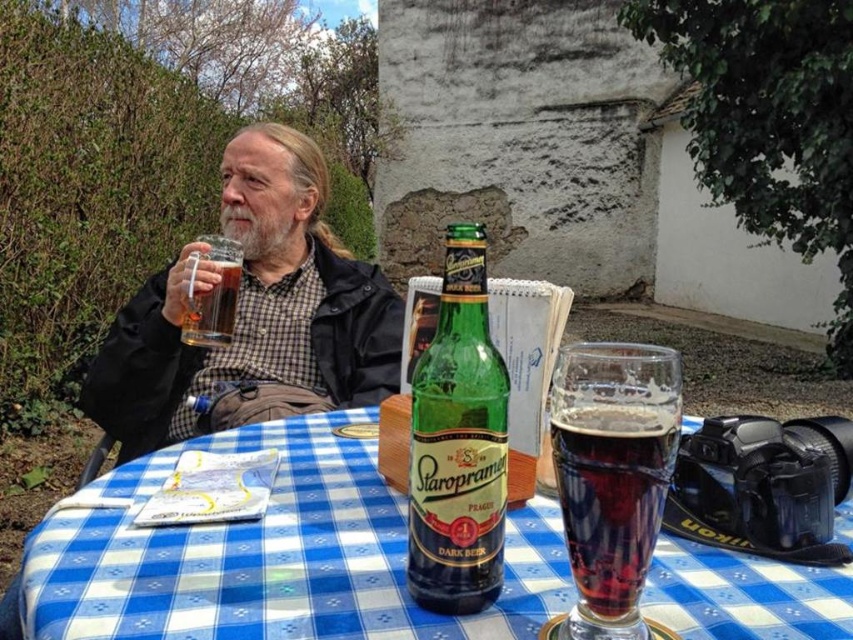
Question: Can you confirm if green glass bottle at center is positioned below dark glass beer at center?

Choices:
 (A) no
 (B) yes

Answer: (A)

Question: Does blue checkered tablecloth at center lie in front of green glass bottle at center?

Choices:
 (A) no
 (B) yes

Answer: (B)

Question: Is blue checkered tablecloth at center wider than matte black jacket at upper left?

Choices:
 (A) yes
 (B) no

Answer: (A)

Question: Which of the following is the closest to the observer?

Choices:
 (A) (229, 282)
 (B) (496, 458)
 (C) (107, 529)
 (D) (320, 193)

Answer: (B)

Question: Which object appears closest to the camera in this image?

Choices:
 (A) blue checkered tablecloth at center
 (B) dark glass beer at center
 (C) translucent glass mug at upper center

Answer: (B)

Question: Which point is farther to the camera?

Choices:
 (A) translucent glass mug at upper center
 (B) green glass bottle at center
 (C) matte black jacket at upper left
 (D) dark glass beer at center

Answer: (C)